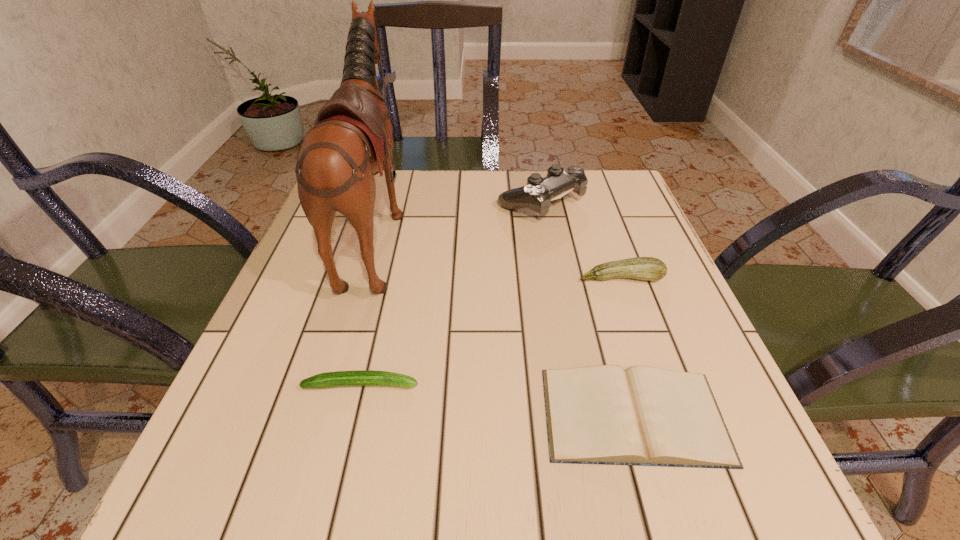
The image size is (960, 540). Find the location of `vacant space situated on the front-facing side of the nearer zucchini`. vacant space situated on the front-facing side of the nearer zucchini is located at coordinates (596, 384).

Identify the location of free space located on the back of the Bible. tap(601, 301).

I want to click on saddle that is at the far edge, so click(x=352, y=140).

This screenshot has width=960, height=540. In order to click on control that is positioned at the far edge in this screenshot , I will do `click(536, 195)`.

What are the coordinates of `object that is at the near edge` in the screenshot? It's located at (643, 416).

The width and height of the screenshot is (960, 540). What are the coordinates of `saddle present at the left edge` in the screenshot? It's located at (352, 140).

You are a GUI agent. You are given a task and a screenshot of the screen. Output one action in this format:
    pyautogui.click(x=<x>, y=<y>)
    Task: Click on the zucchini situated at the left edge
    
    Given the screenshot: What is the action you would take?
    pyautogui.click(x=358, y=377)

Locate an element on the screen. control that is at the right edge is located at coordinates 536,195.

I want to click on zucchini at the right edge, so click(x=642, y=268).

I want to click on Bible present at the right edge, so click(643, 416).